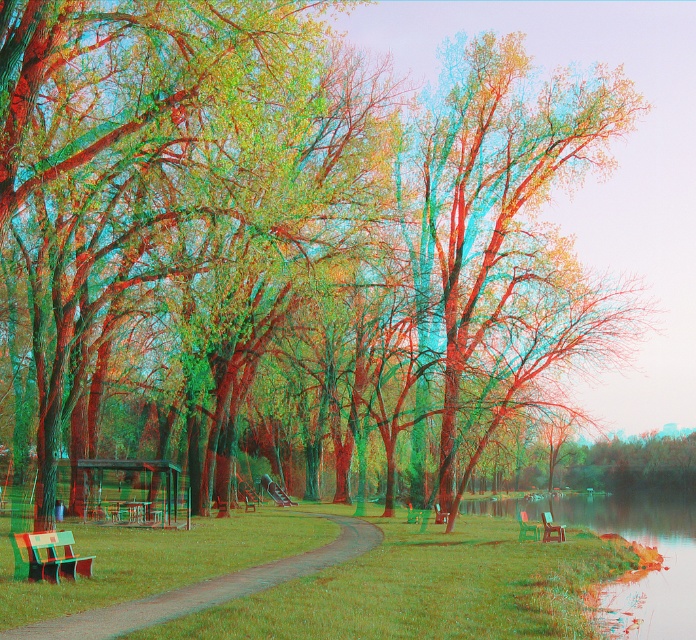
Is green grassy path at center below matte green bench at lower left?

Yes, green grassy path at center is below matte green bench at lower left.

Does point (335, 544) come in front of point (15, 557)?

No, (335, 544) is behind (15, 557).

Identify the location of green grassy path at center. The image size is (696, 640). (205, 588).

Find the location of a particular element. This screenshot has height=640, width=696. matte green bench at lower left is located at coordinates 47,556.

Between matte green bench at lower left and wooden park bench at lower right, which one has more height?

wooden park bench at lower right

Is point (26, 536) positioned after point (557, 529)?

No, it is not.

Find the location of `matte green bench at lower left`. matte green bench at lower left is located at coordinates (47, 556).

Which is below, matte green bench at lower left or green plastic bench at lower right?

Positioned lower is green plastic bench at lower right.

Consider the image. Which of these two, matte green bench at lower left or green plastic bench at lower right, stands taller?

Standing taller between the two is green plastic bench at lower right.

Locate an element on the screen. matte green bench at lower left is located at coordinates (47, 556).